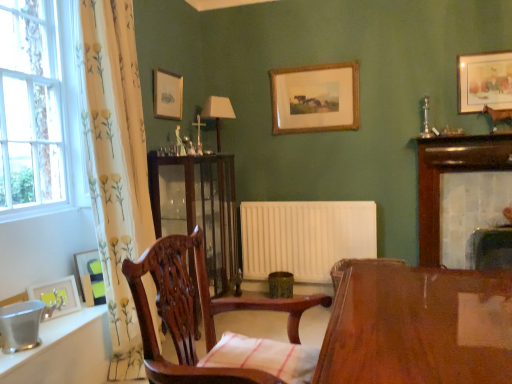
Question: Is white floral curtain at left facing towards wooden picture frame at upper center, the 3th picture frame positioned from the bottom?

Choices:
 (A) yes
 (B) no

Answer: (B)

Question: Can you confirm if white floral curtain at left is thinner than wooden picture frame at upper center, which ranks as the third picture frame in back-to-front order?

Choices:
 (A) yes
 (B) no

Answer: (B)

Question: Is white floral curtain at left not inside wooden picture frame at upper center, which appears as the third picture frame when viewed from the top?

Choices:
 (A) yes
 (B) no

Answer: (A)

Question: Would you say wooden picture frame at upper center, which is the 3th picture frame in right-to-left order, is part of white floral curtain at left's contents?

Choices:
 (A) yes
 (B) no

Answer: (B)

Question: Does white floral curtain at left appear on the left side of wooden picture frame at upper center, which is the 3th picture frame in right-to-left order?

Choices:
 (A) no
 (B) yes

Answer: (B)

Question: Does white floral curtain at left have a greater width compared to wooden picture frame at upper center, which appears as the third picture frame when viewed from the top?

Choices:
 (A) yes
 (B) no

Answer: (A)

Question: Are wooden picture frame at upper right, which ranks as the 1th picture frame in top-to-bottom order, and mahogany wooden chair at center far apart?

Choices:
 (A) yes
 (B) no

Answer: (A)

Question: Can you confirm if wooden picture frame at upper right, which ranks as the 1th picture frame in top-to-bottom order, is taller than mahogany wooden chair at center?

Choices:
 (A) yes
 (B) no

Answer: (B)

Question: Is wooden picture frame at upper right, the 4th picture frame positioned from the front, aimed at mahogany wooden chair at center?

Choices:
 (A) no
 (B) yes

Answer: (A)

Question: Considering the relative sizes of wooden picture frame at upper right, the 4th picture frame positioned from the front, and mahogany wooden chair at center in the image provided, is wooden picture frame at upper right, the 4th picture frame positioned from the front, bigger than mahogany wooden chair at center?

Choices:
 (A) yes
 (B) no

Answer: (B)

Question: Is wooden picture frame at upper right, the 4th picture frame positioned from the front, smaller than mahogany wooden chair at center?

Choices:
 (A) no
 (B) yes

Answer: (B)

Question: Does wooden picture frame at upper right, the 1th picture frame in the right-to-left sequence, appear on the right side of mahogany wooden chair at center?

Choices:
 (A) no
 (B) yes

Answer: (B)

Question: Is mahogany wooden chair at center not near mahogany cabinet at center?

Choices:
 (A) yes
 (B) no

Answer: (B)